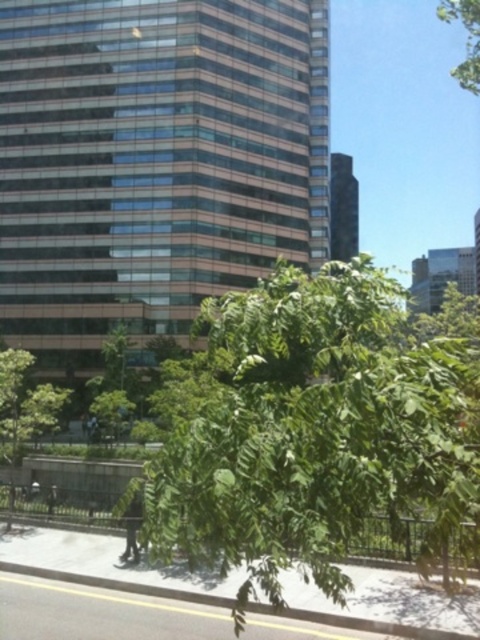
Question: Is glassy brown building at center positioned before green leafy tree at center?

Choices:
 (A) no
 (B) yes

Answer: (A)

Question: Which point is closer to the camera taking this photo?

Choices:
 (A) (116, 148)
 (B) (249, 326)

Answer: (B)

Question: Among these points, which one is nearest to the camera?

Choices:
 (A) (245, 177)
 (B) (298, 456)

Answer: (B)

Question: Is glassy brown building at center to the left of green leafy tree at center from the viewer's perspective?

Choices:
 (A) yes
 (B) no

Answer: (A)

Question: Can you confirm if glassy brown building at center is bigger than green leafy tree at center?

Choices:
 (A) yes
 (B) no

Answer: (A)

Question: Which point is farther to the camera?

Choices:
 (A) (332, 529)
 (B) (132, 296)

Answer: (B)